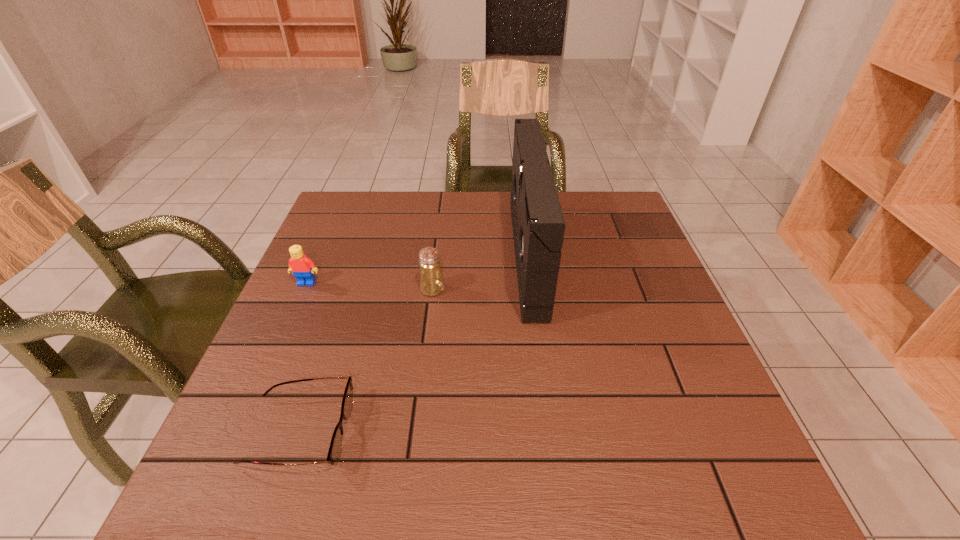
At what (x,y) coordinates should I click in order to perform the action: click on empty space between the saltshaker and the tallest object. Please return your answer as a coordinate pair (x, y). This screenshot has height=540, width=960. Looking at the image, I should click on (480, 273).

At what (x,y) coordinates should I click in order to perform the action: click on empty location between the Lego and the tallest object. Please return your answer as a coordinate pair (x, y). This screenshot has width=960, height=540. Looking at the image, I should click on (417, 269).

This screenshot has width=960, height=540. Find the location of `unoccupied position between the Lego and the shortest object`. unoccupied position between the Lego and the shortest object is located at coordinates (303, 357).

Locate an element on the screen. The height and width of the screenshot is (540, 960). free space between the saltshaker and the Lego is located at coordinates pyautogui.click(x=370, y=286).

Select which object appears as the third closest to the rightmost object. Please provide its 2D coordinates. Your answer should be formatted as a tuple, i.e. [(x, y)], where the tuple contains the x and y coordinates of a point satisfying the conditions above.

[(302, 267)]

This screenshot has width=960, height=540. In order to click on object that is the third closest one to the shortest object in this screenshot , I will do `click(538, 225)`.

Where is `blank space that satisfies the following two spatial constraints: 1. on the side of the videotape with visible spindles; 2. on the face of the Lego`? blank space that satisfies the following two spatial constraints: 1. on the side of the videotape with visible spindles; 2. on the face of the Lego is located at coordinates (531, 283).

Find the location of a particular element. Image resolution: width=960 pixels, height=540 pixels. blank space that satisfies the following two spatial constraints: 1. on the side of the rightmost object with visible spindles; 2. on the face of the Lego is located at coordinates (531, 283).

Identify the location of free space that satisfies the following two spatial constraints: 1. on the face of the Lego; 2. on the right side of the second object from right to left. (304, 289).